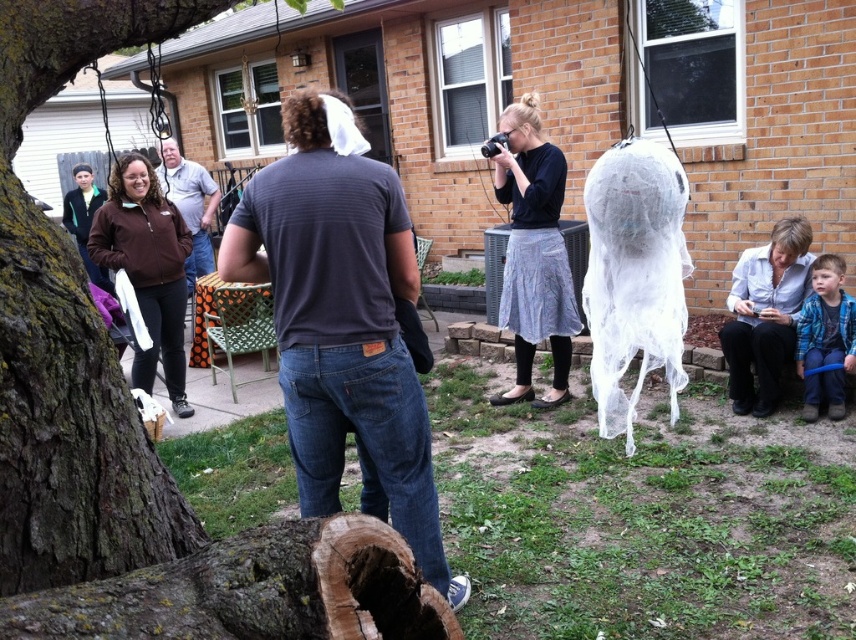
Who is positioned more to the left, smooth bark tree trunk at lower left or blue plaid shirt at lower right?

From the viewer's perspective, smooth bark tree trunk at lower left appears more on the left side.

Based on the photo, can you confirm if smooth bark tree trunk at lower left is positioned below blue plaid shirt at lower right?

No, smooth bark tree trunk at lower left is not below blue plaid shirt at lower right.

Between point (28, 401) and point (803, 385), which one is positioned in front?

Positioned in front is point (28, 401).

The image size is (856, 640). Find the location of `smooth bark tree trunk at lower left`. smooth bark tree trunk at lower left is located at coordinates (132, 432).

Who is higher up, dark gray t-shirt at center or white lace dress at lower right?

white lace dress at lower right is above.

Measure the distance from dark gray t-shirt at center to white lace dress at lower right.

They are 2.51 meters apart.

Measure the distance between point (336, 124) and camera.

Point (336, 124) is 2.28 meters from camera.

Image resolution: width=856 pixels, height=640 pixels. Find the location of `dark gray t-shirt at center`. dark gray t-shirt at center is located at coordinates (342, 317).

Does white lace dress at lower right have a lesser width compared to blue plaid shirt at lower right?

No.

Looking at this image, is white lace dress at lower right below blue plaid shirt at lower right?

Actually, white lace dress at lower right is above blue plaid shirt at lower right.

Identify the location of white lace dress at lower right. (765, 314).

You are a GUI agent. You are given a task and a screenshot of the screen. Output one action in this format:
    pyautogui.click(x=<x>, y=<y>)
    Task: Click on the white lace dress at lower right
    Image resolution: width=856 pixels, height=640 pixels.
    Given the screenshot: What is the action you would take?
    pyautogui.click(x=765, y=314)